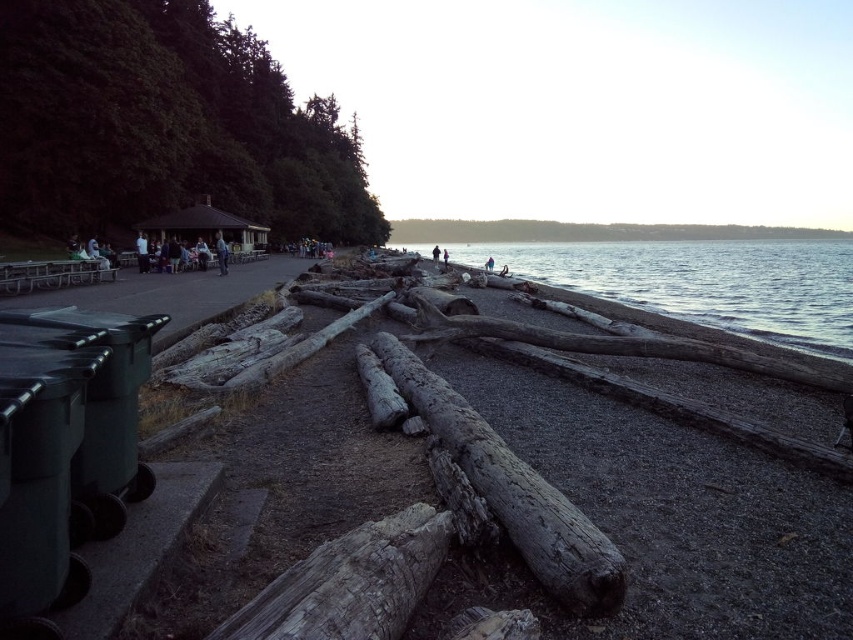
You are standing at the lakeside and want to walk from the weathered wood log at lower center to the clear water at lower right. Which direction should you move?

You should move to the right to reach the clear water at lower right from the weathered wood log at lower center, as the clear water is positioned to the right of the log.

You are standing at the point with coordinates point [322,630] and want to walk to the point with coordinates point [456,435]. Is the point you want to reach visible from your current position?

Point [456,435] is behind point [322,630], so the point you want to reach is not visible from your current position.

You are standing at the lakeside and want to reach the clear water at lower right without stepping on the weathered wood log at center. How can you adjust your path to avoid it?

The weathered wood log at center is behind clear water at lower right, so you can safely walk towards the clear water at lower right directly since the log is located behind it and won